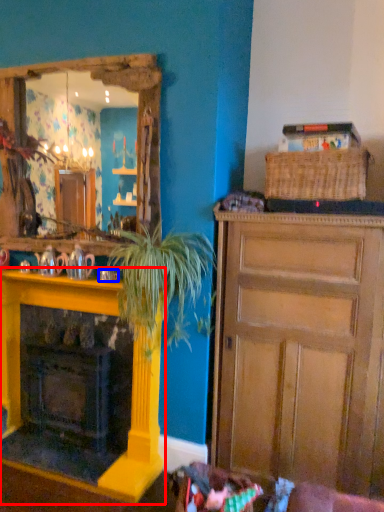
Question: Among these objects, which one is farthest to the camera, fireplace (highlighted by a red box) or coffee cup (highlighted by a blue box)?

Choices:
 (A) fireplace
 (B) coffee cup

Answer: (B)